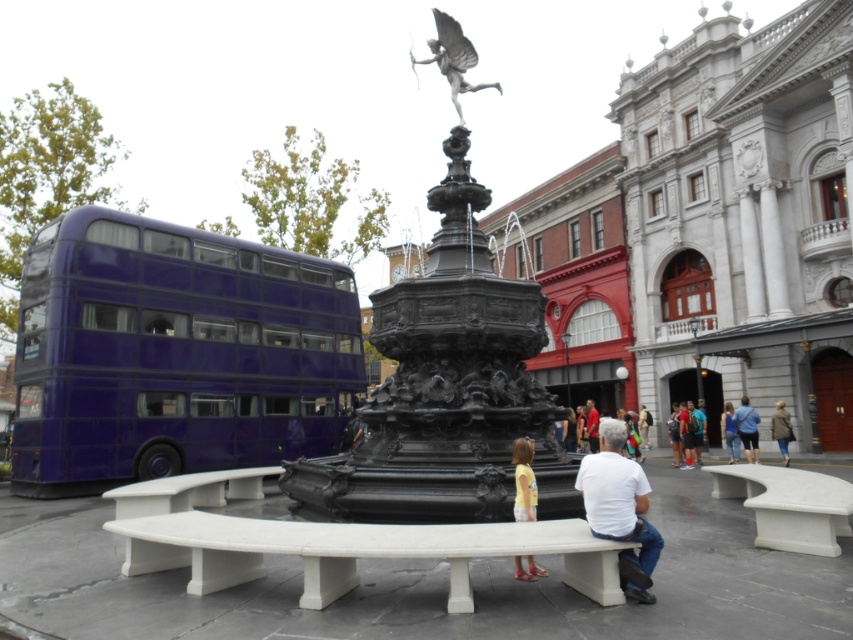
In the scene shown: You are a tourist standing at the center of the square facing the black fountain. You want to take a photo of the metallic purple bus at left and the white marble bench at lower right in the same frame. Which object should you position closer to the left side of your camera viewfinder to include both in the shot?

You should position the metallic purple bus at left closer to the left side of your camera viewfinder since it is already located to the left of the white marble bench at lower right.

You are a photographer trying to capture a clear shot of the white stone bench at center without the white cotton shirt at center blocking it. Based on their positions, is this possible?

The white stone bench at center is positioned under the white cotton shirt at center, so the shirt would block the bench in the photo unless you adjust your angle or position to avoid the overlap.